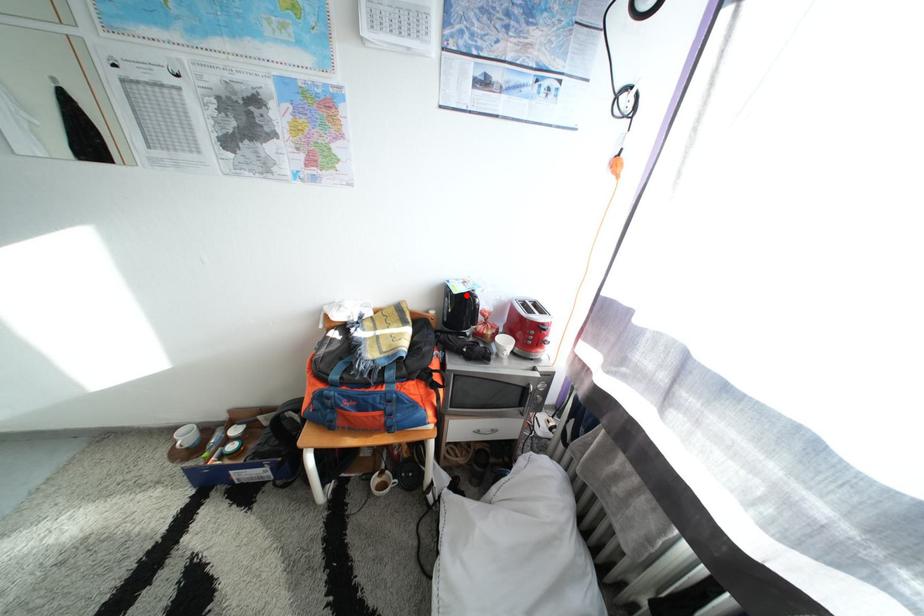
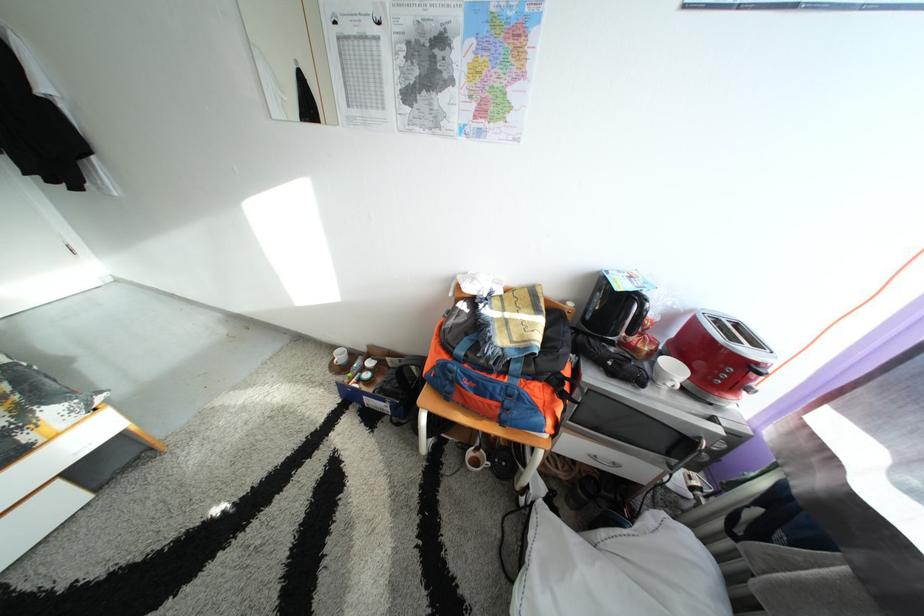
In the second image, find the point that corresponds to the highlighted location in the first image.

(630, 292)